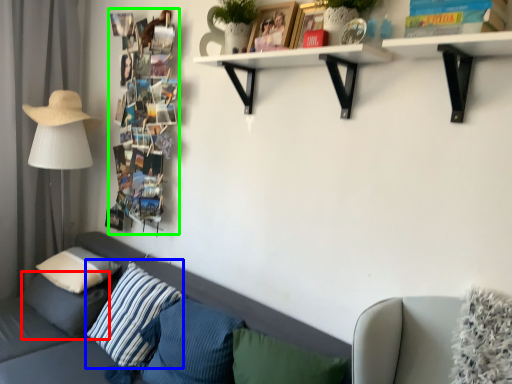
Question: Which object is positioned closest to pillow (highlighted by a red box)? Select from pillow (highlighted by a blue box) and book (highlighted by a green box).

Choices:
 (A) pillow
 (B) book

Answer: (A)